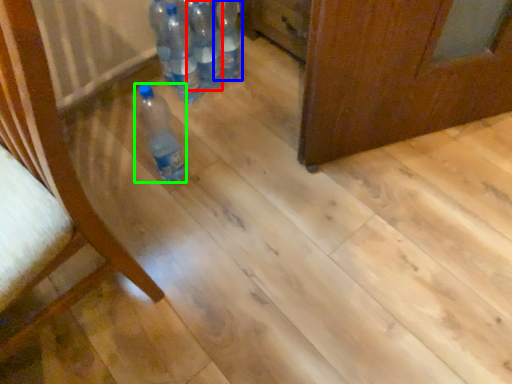
Question: Which is farther away from bottle (highlighted by a red box)? bottle (highlighted by a blue box) or bottle (highlighted by a green box)?

Choices:
 (A) bottle
 (B) bottle

Answer: (B)